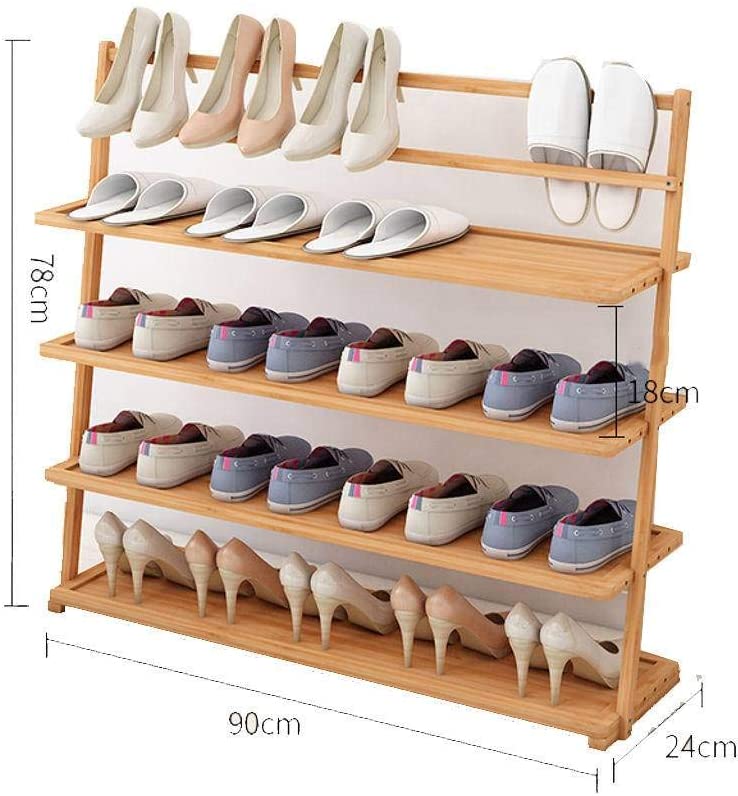
Where is `shoes on top shelf`? This screenshot has width=738, height=796. shoes on top shelf is located at coordinates (111, 197), (144, 203), (220, 201), (280, 219), (353, 229), (392, 244).